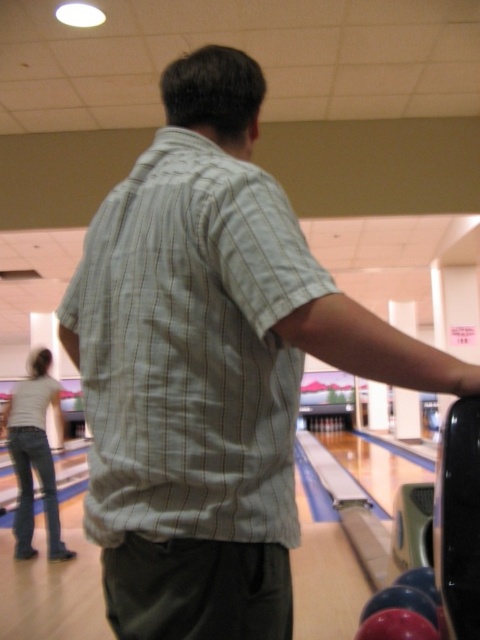
Can you confirm if light green striped shirt at center is taller than white cotton shirt at lower left?

No.

Consider the image. Does light green striped shirt at center appear over white cotton shirt at lower left?

Yes, light green striped shirt at center is above white cotton shirt at lower left.

Is point (158, 364) positioned in front of point (41, 426)?

Yes, it is in front of point (41, 426).

Locate an element on the screen. The image size is (480, 640). light green striped shirt at center is located at coordinates (191, 348).